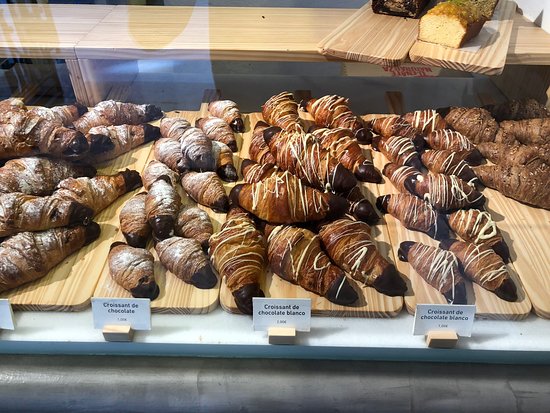
Where is `wood blocks`? The width and height of the screenshot is (550, 413). wood blocks is located at coordinates (440, 343), (276, 334), (109, 332).